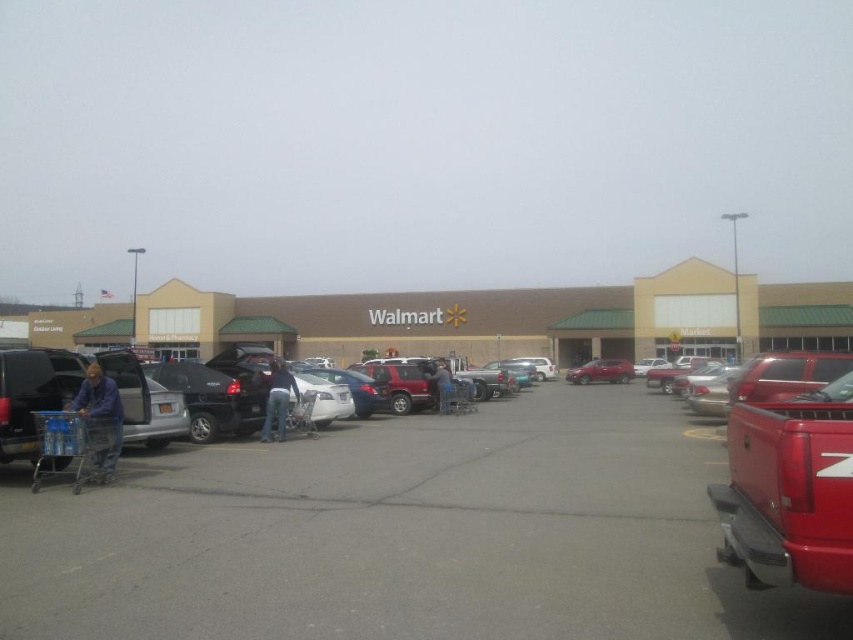
You are standing at the Walmart parking lot and want to know which of the two points, point (733, 554) or point (271, 426), is closer to you. Can you determine this based on the scene?

Point (733, 554) is closer to the viewer than point (271, 426).

You are a delivery person who needs to load a tall package into the red matte truck at right. You see the metallic silver shopping cart at lower left parked nearby. Based on their heights, can the shopping cart block the loading process if placed in front of the truck?

The red matte truck at right is not as tall as metallic silver shopping cart at lower left, so the shopping cart could potentially block the loading process if placed in front of the truck due to its greater height.